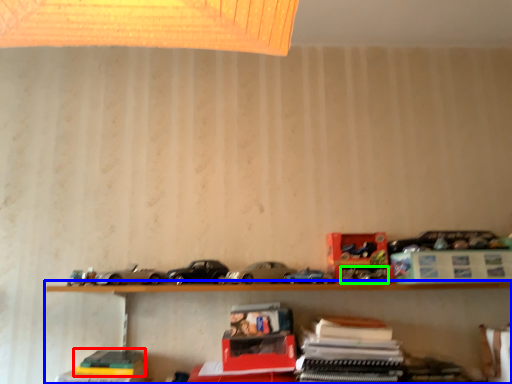
Question: Which is nearer to the book (highlighted by a red box)? shelf (highlighted by a blue box) or toy (highlighted by a green box).

Choices:
 (A) shelf
 (B) toy

Answer: (A)